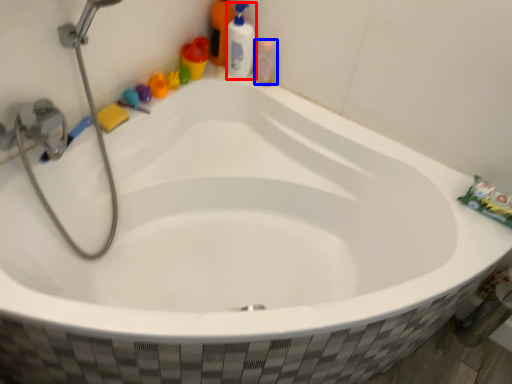
Question: Which object is closer to the camera taking this photo, cleaning product (highlighted by a red box) or mouthwash (highlighted by a blue box)?

Choices:
 (A) cleaning product
 (B) mouthwash

Answer: (A)